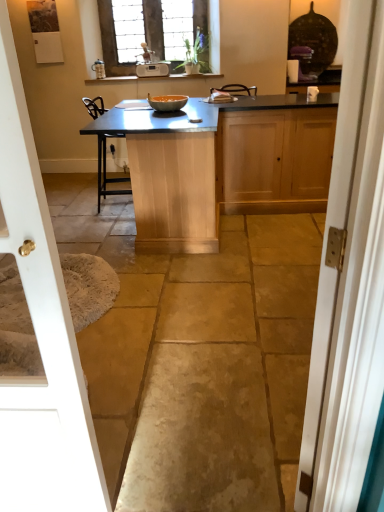
At what (x,y) coordinates should I click in order to perform the action: click on natural stone floor at center. Please return your answer as a coordinate pair (x, y). This screenshot has width=384, height=512. Looking at the image, I should click on (197, 356).

Measure the distance between white plastic radio at upper center and camera.

The distance of white plastic radio at upper center from camera is 5.41 meters.

Where is `light wood cabinet at center, positioned as the 1th cabinetry in left-to-right order`? This screenshot has height=512, width=384. light wood cabinet at center, positioned as the 1th cabinetry in left-to-right order is located at coordinates (219, 167).

What do you see at coordinates (40, 334) in the screenshot? This screenshot has height=512, width=384. I see `white glossy door at left, the first door in the left-to-right sequence` at bounding box center [40, 334].

The height and width of the screenshot is (512, 384). In order to click on natural stone floor at center in this screenshot , I will do `click(197, 356)`.

Is natural stone floor at center oriented away from translucent glass bowl at center?

That's not correct — natural stone floor at center is not looking away from translucent glass bowl at center.

Can you confirm if natural stone floor at center is thinner than translucent glass bowl at center?

No.

Is natural stone floor at center completely or partially outside of translucent glass bowl at center?

natural stone floor at center lies outside translucent glass bowl at center's area.

Does natural stone floor at center appear on the left side of translucent glass bowl at center?

Yes, natural stone floor at center is to the left of translucent glass bowl at center.

From the image's perspective, would you say matte silver faucet at upper center is shown under white painted wood door at right, which is the 2th door from left to right?

No, from the image's perspective, matte silver faucet at upper center is not below white painted wood door at right, which is the 2th door from left to right.

Considering the positions of objects matte silver faucet at upper center and white painted wood door at right, arranged as the 1th door when viewed from the right, in the image provided, who is more to the right, matte silver faucet at upper center or white painted wood door at right, arranged as the 1th door when viewed from the right,?

white painted wood door at right, arranged as the 1th door when viewed from the right, is more to the right.

How many degrees apart are the facing directions of matte silver faucet at upper center and white painted wood door at right, arranged as the 1th door when viewed from the right?

There is a 126-degree angle between the facing directions of matte silver faucet at upper center and white painted wood door at right, arranged as the 1th door when viewed from the right.

Measure the distance from matte wood cabinet at right, which is counted as the 2th cabinetry, starting from the left, to matte silver faucet at upper center.

matte wood cabinet at right, which is counted as the 2th cabinetry, starting from the left, is 9.33 feet away from matte silver faucet at upper center.

Is matte wood cabinet at right, which is the first cabinetry in right-to-left order, inside or outside of matte silver faucet at upper center?

matte wood cabinet at right, which is the first cabinetry in right-to-left order, is located beyond the bounds of matte silver faucet at upper center.

From the image's perspective, would you say matte wood cabinet at right, which is the first cabinetry in right-to-left order, is shown under matte silver faucet at upper center?

Yes, from the image's perspective, matte wood cabinet at right, which is the first cabinetry in right-to-left order, is below matte silver faucet at upper center.

Is the position of translucent glass bowl at center more distant than that of light wood cabinet at center, which appears as the second cabinetry when viewed from the right?

Yes, translucent glass bowl at center is further from the camera.

In the scene shown: Between translucent glass bowl at center and light wood cabinet at center, positioned as the 1th cabinetry in left-to-right order, which one has larger size?

light wood cabinet at center, positioned as the 1th cabinetry in left-to-right order.

Which of these two, translucent glass bowl at center or light wood cabinet at center, which appears as the second cabinetry when viewed from the right, is wider?

light wood cabinet at center, which appears as the second cabinetry when viewed from the right, is wider.

From the picture: Which of these two, translucent glass bowl at center or light wood cabinet at center, which appears as the second cabinetry when viewed from the right, stands taller?

With more height is light wood cabinet at center, which appears as the second cabinetry when viewed from the right.

How distant is stained glass window at upper center from light wood cabinet at center, which appears as the second cabinetry when viewed from the right?

stained glass window at upper center and light wood cabinet at center, which appears as the second cabinetry when viewed from the right, are 8.42 feet apart from each other.

Is stained glass window at upper center oriented towards light wood cabinet at center, positioned as the 1th cabinetry in left-to-right order?

Yes.

Who is more distant, stained glass window at upper center or light wood cabinet at center, which appears as the second cabinetry when viewed from the right?

Positioned behind is stained glass window at upper center.

Between stained glass window at upper center and light wood cabinet at center, which appears as the second cabinetry when viewed from the right, which one has more height?

light wood cabinet at center, which appears as the second cabinetry when viewed from the right.

Looking at this image, measure the distance between natural stone floor at center and matte silver faucet at upper center.

They are 3.96 meters apart.

Is point (154, 263) farther from camera compared to point (145, 58)?

No, it is in front of (145, 58).

Is natural stone floor at center taller or shorter than matte silver faucet at upper center?

Clearly, natural stone floor at center is shorter compared to matte silver faucet at upper center.

From a real-world perspective, is natural stone floor at center under matte silver faucet at upper center?

Yes.

Is white glossy door at left, the first door in the left-to-right sequence, inside light wood cabinet at center, positioned as the 1th cabinetry in left-to-right order?

That's incorrect, white glossy door at left, the first door in the left-to-right sequence, is not inside light wood cabinet at center, positioned as the 1th cabinetry in left-to-right order.

Does light wood cabinet at center, which appears as the second cabinetry when viewed from the right, have a greater width compared to white glossy door at left, placed as the second door when sorted from right to left?

Yes, light wood cabinet at center, which appears as the second cabinetry when viewed from the right, is wider than white glossy door at left, placed as the second door when sorted from right to left.

Which point is more forward, (x=228, y=157) or (x=4, y=1)?

Point (x=4, y=1)

This screenshot has width=384, height=512. Find the location of `glass bowl behind the natural stone floor at center`. glass bowl behind the natural stone floor at center is located at coordinates (167, 102).

Locate an element on the screen. The height and width of the screenshot is (512, 384). the 2nd door counting from the right of the matte silver faucet at upper center is located at coordinates 349,284.

Looking at the image, which one is located closer to light wood cabinet at center, positioned as the 1th cabinetry in left-to-right order, translucent glass bowl at center or natural stone floor at center?

Among the two, natural stone floor at center is located nearer to light wood cabinet at center, positioned as the 1th cabinetry in left-to-right order.

Which object lies further to the anchor point stained glass window at upper center, matte silver faucet at upper center or white painted wood door at right, arranged as the 1th door when viewed from the right?

The object further to stained glass window at upper center is white painted wood door at right, arranged as the 1th door when viewed from the right.

Looking at the image, which one is located closer to white glossy door at left, the first door in the left-to-right sequence, white painted wood door at right, which is the 2th door from left to right, or matte wood cabinet at right, which is the first cabinetry in right-to-left order?

white painted wood door at right, which is the 2th door from left to right, lies closer to white glossy door at left, the first door in the left-to-right sequence, than the other object.

Considering their positions, is translucent glass bowl at center positioned further to stained glass window at upper center than light wood cabinet at center, positioned as the 1th cabinetry in left-to-right order?

light wood cabinet at center, positioned as the 1th cabinetry in left-to-right order, lies further to stained glass window at upper center than the other object.

From the image, which object appears to be nearer to white glossy door at left, placed as the second door when sorted from right to left, stained glass window at upper center or matte wood cabinet at right, which is counted as the 2th cabinetry, starting from the left?

matte wood cabinet at right, which is counted as the 2th cabinetry, starting from the left, is positioned closer to the anchor white glossy door at left, placed as the second door when sorted from right to left.

Which object lies further to the anchor point white glossy door at left, placed as the second door when sorted from right to left, matte wood cabinet at right, which is the first cabinetry in right-to-left order, or white painted wood door at right, which is the 2th door from left to right?

matte wood cabinet at right, which is the first cabinetry in right-to-left order, is positioned further to the anchor white glossy door at left, placed as the second door when sorted from right to left.

In the scene shown: Based on their spatial positions, is light wood cabinet at center, positioned as the 1th cabinetry in left-to-right order, or white painted wood door at right, which is the 2th door from left to right, closer to translucent glass bowl at center?

light wood cabinet at center, positioned as the 1th cabinetry in left-to-right order, is positioned closer to the anchor translucent glass bowl at center.

Which object lies further to the anchor point translucent glass bowl at center, light wood cabinet at center, which appears as the second cabinetry when viewed from the right, or white glossy door at left, placed as the second door when sorted from right to left?

white glossy door at left, placed as the second door when sorted from right to left, is positioned further to the anchor translucent glass bowl at center.

This screenshot has height=512, width=384. Find the location of `window between translucent glass bowl at center and white plastic radio at upper center in the front-back direction`. window between translucent glass bowl at center and white plastic radio at upper center in the front-back direction is located at coordinates (159, 32).

Image resolution: width=384 pixels, height=512 pixels. Identify the location of window positioned between translucent glass bowl at center and matte silver faucet at upper center from near to far. (159, 32).

The height and width of the screenshot is (512, 384). What are the coordinates of `window located between white glossy door at left, placed as the second door when sorted from right to left, and white plastic radio at upper center in the depth direction` in the screenshot? It's located at (159, 32).

I want to click on door positioned between white painted wood door at right, which is the 2th door from left to right, and white plastic radio at upper center from near to far, so click(x=40, y=334).